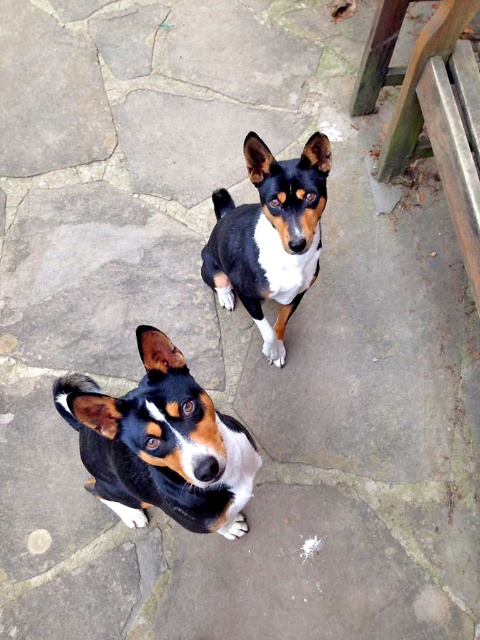
Who is more forward, (155, 385) or (249, 144)?

Point (155, 385) is in front.

Who is higher up, smooth black and white dog at center or black and white fur dog at center?

Positioned higher is black and white fur dog at center.

Which is in front, point (132, 452) or point (216, 291)?

Point (132, 452) is in front.

This screenshot has width=480, height=640. Identify the location of smooth black and white dog at center. (162, 444).